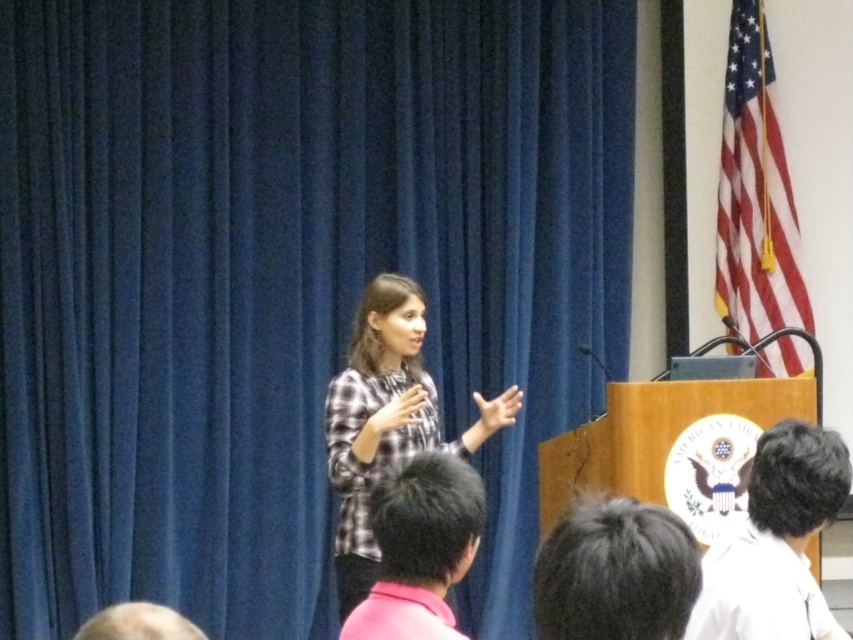
Question: Is plaid fabric shirt at center thinner than black hair at upper right?

Choices:
 (A) yes
 (B) no

Answer: (B)

Question: Which point is farther to the camera?

Choices:
 (A) (375, 612)
 (B) (54, 122)
 (C) (90, 634)
 (D) (753, 582)

Answer: (B)

Question: Can you confirm if black hair at upper right is bigger than black hair at upper center?

Choices:
 (A) no
 (B) yes

Answer: (B)

Question: Which object appears closest to the camera in this image?

Choices:
 (A) black hair at upper center
 (B) pink fabric head at lower center

Answer: (A)

Question: Can you confirm if blue fabric curtain at center is positioned to the left of black hair at upper center?

Choices:
 (A) yes
 (B) no

Answer: (A)

Question: Among these objects, which one is farthest from the camera?

Choices:
 (A) black hair at upper right
 (B) blonde hair at lower left
 (C) plaid fabric shirt at center

Answer: (B)